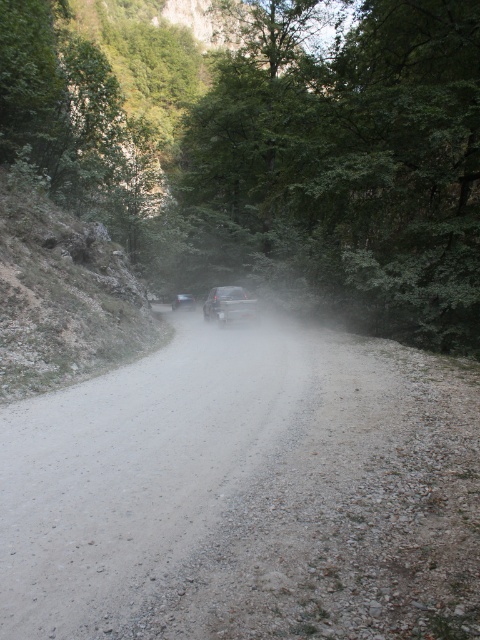
Can you confirm if green leafy tree at center is positioned to the left of smokey gray car at center?

Correct, you'll find green leafy tree at center to the left of smokey gray car at center.

Which is below, green leafy tree at center or smokey gray car at center?

Positioned lower is smokey gray car at center.

The height and width of the screenshot is (640, 480). What do you see at coordinates (271, 148) in the screenshot?
I see `green leafy tree at center` at bounding box center [271, 148].

The height and width of the screenshot is (640, 480). In order to click on green leafy tree at center in this screenshot , I will do `click(271, 148)`.

Which is above, green leafy tree at center or metallic silver car at center?

green leafy tree at center

Who is more distant from viewer, (441, 314) or (229, 291)?

The point (229, 291) is behind.

Image resolution: width=480 pixels, height=640 pixels. I want to click on green leafy tree at center, so click(271, 148).

Who is positioned more to the right, gray gravel road at center or smokey gray car at center?

Positioned to the right is gray gravel road at center.

Where is `gray gravel road at center`? The image size is (480, 640). gray gravel road at center is located at coordinates (245, 492).